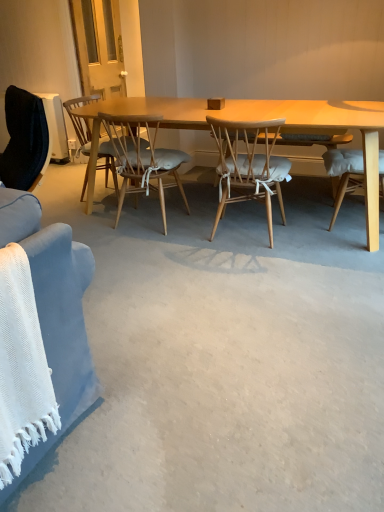
Locate an element on the screen. free location to the right of light brown woven wood chair at center, the first chair positioned from the right is located at coordinates (316, 239).